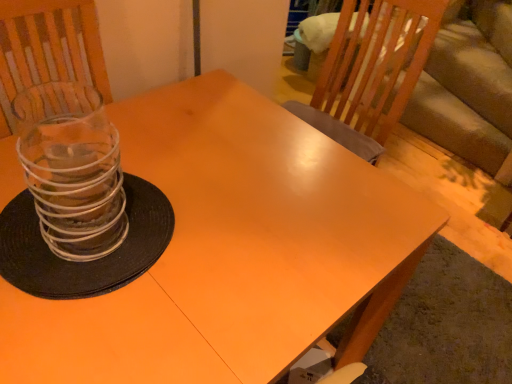
Question: Can you confirm if matte orange table at center is taller than clear glass candle holder at left?

Choices:
 (A) no
 (B) yes

Answer: (B)

Question: Considering the relative sizes of matte orange table at center and clear glass candle holder at left in the image provided, is matte orange table at center smaller than clear glass candle holder at left?

Choices:
 (A) no
 (B) yes

Answer: (A)

Question: Are matte orange table at center and clear glass candle holder at left far apart?

Choices:
 (A) yes
 (B) no

Answer: (B)

Question: Considering the relative positions of matte orange table at center and clear glass candle holder at left in the image provided, is matte orange table at center in front of clear glass candle holder at left?

Choices:
 (A) yes
 (B) no

Answer: (A)

Question: Does matte orange table at center appear on the right side of clear glass candle holder at left?

Choices:
 (A) yes
 (B) no

Answer: (A)

Question: Can we say matte orange table at center lies outside clear glass candle holder at left?

Choices:
 (A) yes
 (B) no

Answer: (A)

Question: Does clear glass candle holder at left have a lesser height compared to matte orange table at center?

Choices:
 (A) no
 (B) yes

Answer: (B)

Question: Could you tell me if clear glass candle holder at left is turned towards matte orange table at center?

Choices:
 (A) yes
 (B) no

Answer: (B)

Question: Is clear glass candle holder at left positioned with its back to matte orange table at center?

Choices:
 (A) no
 (B) yes

Answer: (A)

Question: From the image's perspective, is clear glass candle holder at left below matte orange table at center?

Choices:
 (A) no
 (B) yes

Answer: (A)

Question: Is clear glass candle holder at left positioned in front of matte orange table at center?

Choices:
 (A) yes
 (B) no

Answer: (B)

Question: Is the position of clear glass candle holder at left more distant than that of matte orange table at center?

Choices:
 (A) no
 (B) yes

Answer: (B)

Question: From their relative heights in the image, would you say matte orange table at center is taller or shorter than clear glass candle holder at left?

Choices:
 (A) short
 (B) tall

Answer: (B)